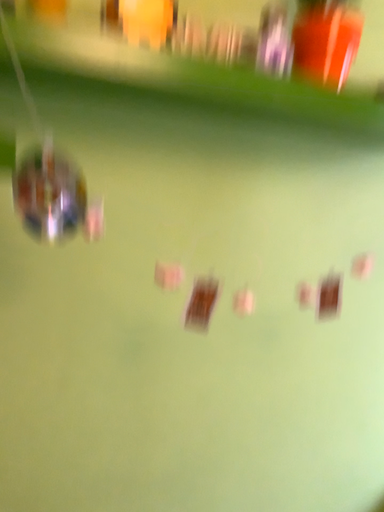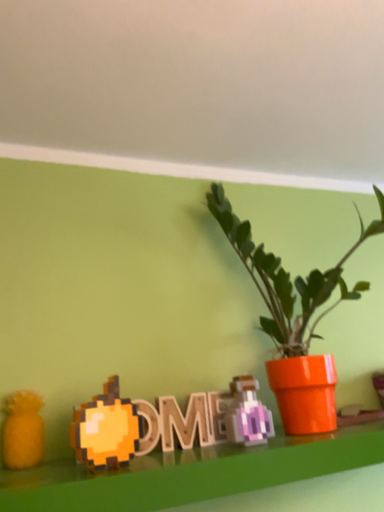
Question: Which way did the camera rotate in the video?

Choices:
 (A) rotated right
 (B) rotated left

Answer: (B)